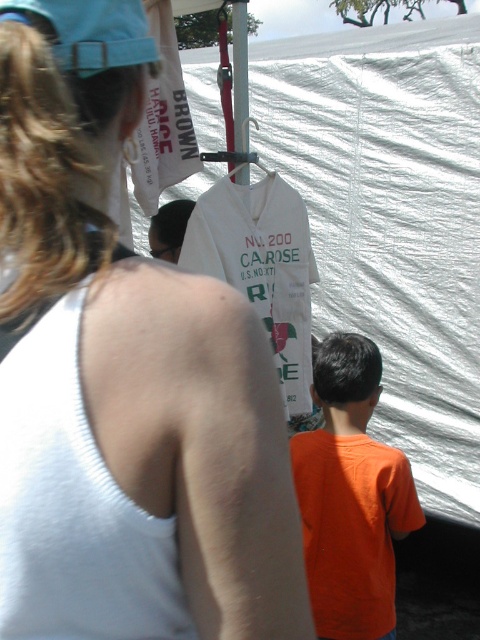
You are a photographer trying to capture a photo of the white fabric tent at center and the orange matte shirt at lower right. From the photographer perspective, which object is located to the left of the other?

The orange matte shirt at lower right is located to the left of the white fabric tent at center because the white fabric tent at center is positioned on the right side of orange matte shirt at lower right.

In the scene shown: What is the position of the white fabric tank top at upper left relative to the point marked at coordinates (x=123, y=376)?

The point marked at coordinates (x=123, y=376) marks the white fabric tank top at upper left.